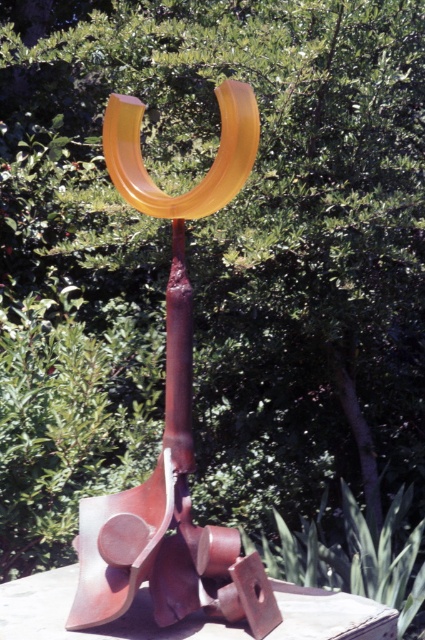
Based on the photo, between matte yellow metal sculpture at center and translucent amber horseshoe at center, which one appears on the right side from the viewer's perspective?

translucent amber horseshoe at center

Find the location of a particular element. matte yellow metal sculpture at center is located at coordinates (172, 419).

Is point (144, 545) positioned behind point (124, 186)?

No, it is in front of (124, 186).

You are a GUI agent. You are given a task and a screenshot of the screen. Output one action in this format:
    pyautogui.click(x=<x>, y=<y>)
    Task: Click on the matte yellow metal sculpture at center
    
    Given the screenshot: What is the action you would take?
    pyautogui.click(x=172, y=419)

Between matte yellow metal sculpture at center and rusty metal sculpture at center, which one has less height?

Standing shorter between the two is rusty metal sculpture at center.

The width and height of the screenshot is (425, 640). I want to click on matte yellow metal sculpture at center, so pyautogui.click(x=172, y=419).

Locate an element on the screen. matte yellow metal sculpture at center is located at coordinates (172, 419).

Who is higher up, rusty metal sculpture at center or translucent amber horseshoe at center?

Positioned higher is translucent amber horseshoe at center.

Does rusty metal sculpture at center have a smaller size compared to translucent amber horseshoe at center?

Incorrect, rusty metal sculpture at center is not smaller in size than translucent amber horseshoe at center.

The image size is (425, 640). What do you see at coordinates (93, 627) in the screenshot?
I see `rusty metal sculpture at center` at bounding box center [93, 627].

Find the location of `rusty metal sculpture at center`. rusty metal sculpture at center is located at coordinates (93, 627).